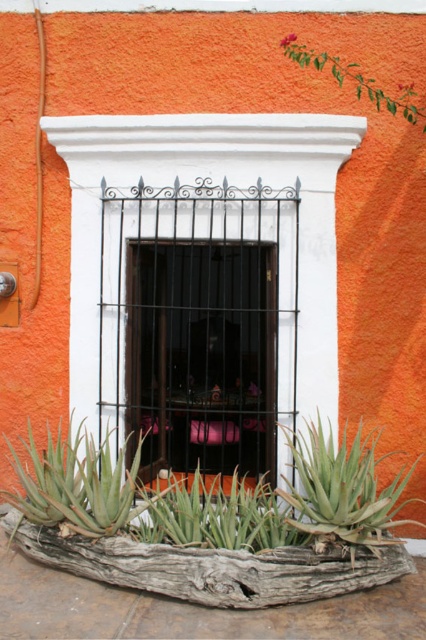
You are a gardener checking the plants in front of the window. You notice the weathered wood log at lower center and the green succulent at lower center. Which one is shorter?

The weathered wood log at lower center is shorter than the green succulent at lower center.

You are a painter standing on a ladder that is 6 feet tall. You need to paint both the matte black window at center and the green leafy branch at upper right. Can you reach both objects without moving the ladder?

The distance between the matte black window at center and the green leafy branch at upper right is 7.30 feet. Since the ladder is only 6 feet tall, you cannot reach both objects without moving the ladder because the distance exceeds the ladder height.

You are a gardener who needs to water both the green leafy plant at lower center and the green succulent at lower left. Your watering can has a maximum reach of 10 inches. Can you water both plants without moving the watering can?

The distance between the green leafy plant at lower center and the green succulent at lower left is 9.62 inches. Since the watering can can reach up to 10 inches, you can water both plants without moving the watering can.